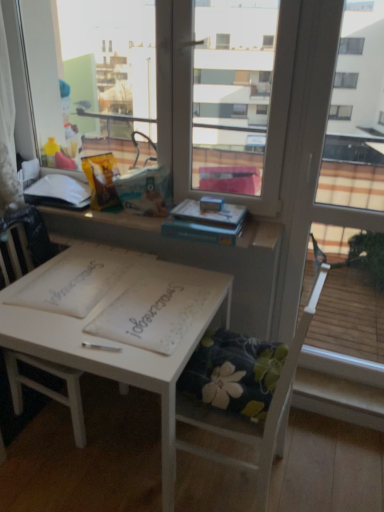
Find the location of `spots to the right of white paper notebook at center, the 1th notebook in the left-to-right sequence`. spots to the right of white paper notebook at center, the 1th notebook in the left-to-right sequence is located at coordinates (149, 279).